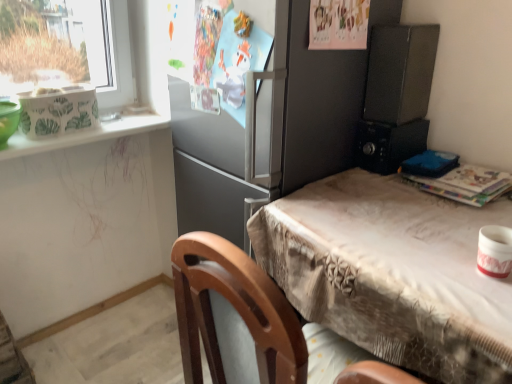
Question: Does black plastic microwave at right, which appears as the 1th appliance when viewed from the back, have a lesser width compared to satin gray refrigerator at center?

Choices:
 (A) no
 (B) yes

Answer: (B)

Question: Is black plastic microwave at right, which is the second appliance in top-to-bottom order, next to satin gray refrigerator at center and touching it?

Choices:
 (A) no
 (B) yes

Answer: (A)

Question: Considering the relative positions of black plastic microwave at right, marked as the third appliance in a front-to-back arrangement, and satin gray refrigerator at center in the image provided, is black plastic microwave at right, marked as the third appliance in a front-to-back arrangement, in front of satin gray refrigerator at center?

Choices:
 (A) yes
 (B) no

Answer: (B)

Question: From the image's perspective, is black plastic microwave at right, which is the second appliance in bottom-to-top order, on top of satin gray refrigerator at center?

Choices:
 (A) yes
 (B) no

Answer: (A)

Question: Considering the relative positions of black plastic microwave at right, which is the second appliance in top-to-bottom order, and satin gray refrigerator at center in the image provided, is black plastic microwave at right, which is the second appliance in top-to-bottom order, to the left of satin gray refrigerator at center from the viewer's perspective?

Choices:
 (A) yes
 (B) no

Answer: (B)

Question: Would you say black plastic microwave at right, which appears as the 1th appliance when viewed from the back, is inside or outside matte black microwave at upper right, the 2th appliance viewed from the front?

Choices:
 (A) outside
 (B) inside

Answer: (A)

Question: Considering the relative positions of black plastic microwave at right, which is the second appliance in bottom-to-top order, and matte black microwave at upper right, placed as the second appliance when sorted from back to front, in the image provided, is black plastic microwave at right, which is the second appliance in bottom-to-top order, to the left or to the right of matte black microwave at upper right, placed as the second appliance when sorted from back to front,?

Choices:
 (A) right
 (B) left

Answer: (B)

Question: In the image, is black plastic microwave at right, marked as the third appliance in a front-to-back arrangement, positioned in front of or behind matte black microwave at upper right, the 2th appliance viewed from the front?

Choices:
 (A) front
 (B) behind

Answer: (B)

Question: From a real-world perspective, is black plastic microwave at right, which is the second appliance in top-to-bottom order, physically located above or below matte black microwave at upper right, the first appliance when ordered from top to bottom?

Choices:
 (A) above
 (B) below

Answer: (B)

Question: Is point (370, 150) closer or farther from the camera than point (263, 148)?

Choices:
 (A) closer
 (B) farther

Answer: (B)

Question: Would you say black plastic microwave at right, which is the second appliance in top-to-bottom order, is inside or outside satin gray refrigerator at center?

Choices:
 (A) inside
 (B) outside

Answer: (B)

Question: Is black plastic microwave at right, which appears as the 1th appliance when viewed from the back, taller or shorter than satin gray refrigerator at center?

Choices:
 (A) short
 (B) tall

Answer: (A)

Question: Would you say black plastic microwave at right, which is the second appliance in bottom-to-top order, is to the left or to the right of satin gray refrigerator at center in the picture?

Choices:
 (A) right
 (B) left

Answer: (A)

Question: From the image's perspective, is matte black microwave at upper right, the first appliance when ordered from top to bottom, located above or below black plastic microwave at right, which is the second appliance in bottom-to-top order?

Choices:
 (A) below
 (B) above

Answer: (B)

Question: Considering the positions of point (388, 91) and point (391, 148), is point (388, 91) closer or farther from the camera than point (391, 148)?

Choices:
 (A) farther
 (B) closer

Answer: (B)